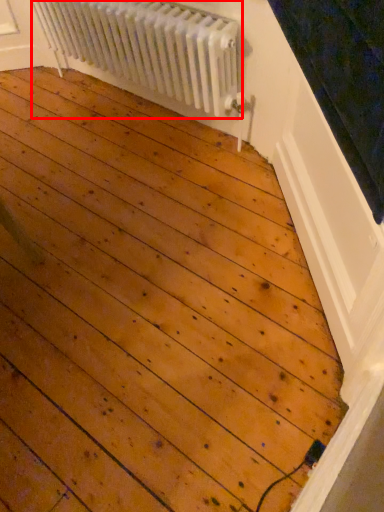
Question: Where is radiator (annotated by the red box) located in relation to window sill in the image?

Choices:
 (A) right
 (B) left

Answer: (B)